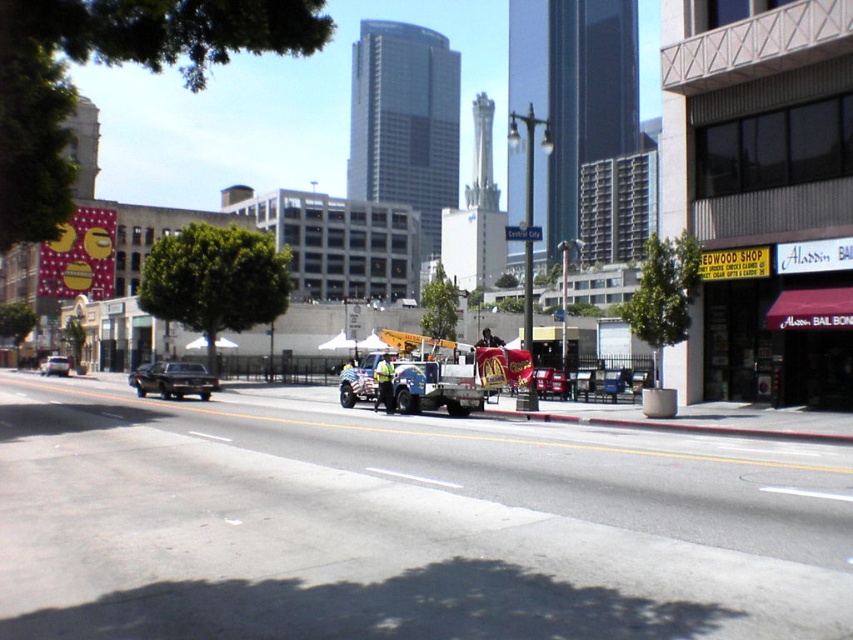
Question: From the image, what is the correct spatial relationship of metallic blue tow truck at center in relation to metallic silver car at center?

Choices:
 (A) left
 (B) right

Answer: (A)

Question: Which of the following is the closest to the observer?

Choices:
 (A) metallic blue tow truck at center
 (B) shiny silver sedan at center-left

Answer: (A)

Question: Which point appears farthest from the camera in this image?

Choices:
 (A) pyautogui.click(x=386, y=337)
 (B) pyautogui.click(x=151, y=372)
 (C) pyautogui.click(x=550, y=394)
 (D) pyautogui.click(x=57, y=371)

Answer: (D)

Question: Does metallic silver car at center have a larger size compared to shiny silver sedan at center-left?

Choices:
 (A) no
 (B) yes

Answer: (A)

Question: Does matte black truck at left have a lesser width compared to shiny silver sedan at center-left?

Choices:
 (A) yes
 (B) no

Answer: (B)

Question: Which of the following is the closest to the observer?

Choices:
 (A) metallic blue tow truck at center
 (B) shiny silver sedan at center-left

Answer: (A)